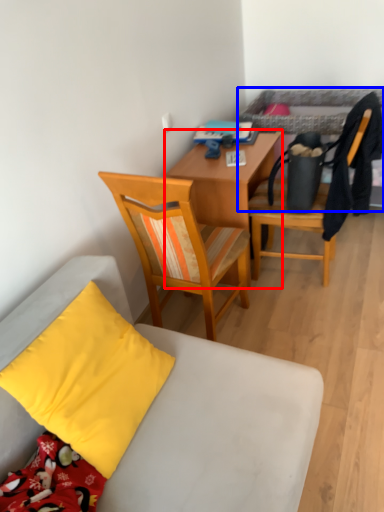
Question: Among these objects, which one is farthest to the camera, desk (highlighted by a red box) or bed (highlighted by a blue box)?

Choices:
 (A) desk
 (B) bed

Answer: (A)